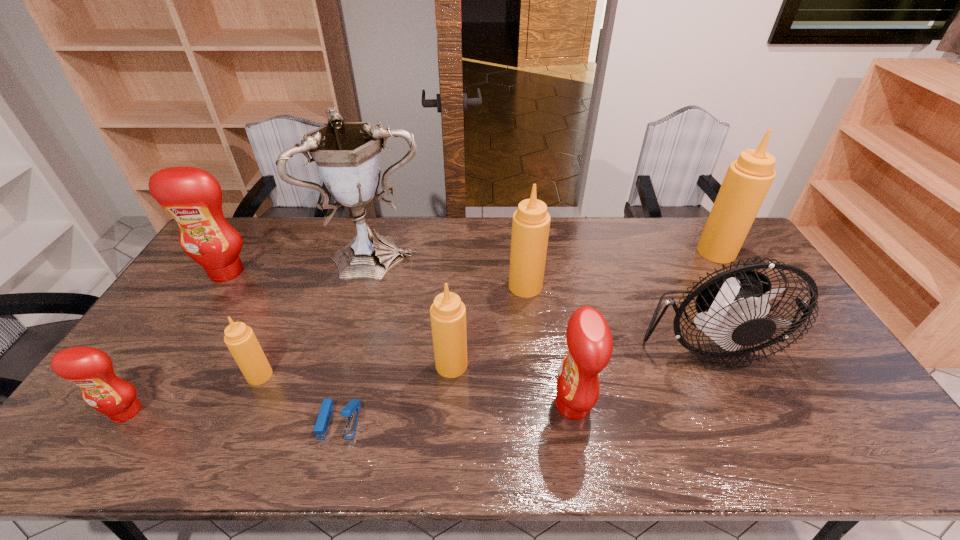
The height and width of the screenshot is (540, 960). In order to click on free space that is in between the second tan condiment from right to left and the biggest tan condiment in this screenshot , I will do `click(621, 269)`.

Where is `vacant space in between the third condiment from left to right and the second smallest tan condiment`? This screenshot has height=540, width=960. vacant space in between the third condiment from left to right and the second smallest tan condiment is located at coordinates (355, 370).

Where is `empty space that is in between the gray trophy cup and the third tan condiment from left to right`? empty space that is in between the gray trophy cup and the third tan condiment from left to right is located at coordinates (452, 270).

Find the location of `unoccupied position between the third nearest tan condiment and the shortest object`. unoccupied position between the third nearest tan condiment and the shortest object is located at coordinates (432, 354).

Find the location of a particular element. empty space between the second tan condiment from right to left and the stapler is located at coordinates (432, 354).

Image resolution: width=960 pixels, height=540 pixels. What are the coordinates of `object that stands as the eighth closest to the tallest condiment` in the screenshot? It's located at (193, 197).

Identify which object is the closest to the rightmost red condiment. Please provide its 2D coordinates. Your answer should be formatted as a tuple, i.e. [(x, y)], where the tuple contains the x and y coordinates of a point satisfying the conditions above.

[(732, 305)]

The width and height of the screenshot is (960, 540). I want to click on condiment object that ranks as the closest to the biggest red condiment, so click(x=240, y=339).

Identify which condiment is located as the third nearest to the third tan condiment from right to left. Please provide its 2D coordinates. Your answer should be formatted as a tuple, i.e. [(x, y)], where the tuple contains the x and y coordinates of a point satisfying the conditions above.

[(240, 339)]

This screenshot has width=960, height=540. In order to click on tan condiment that is the third nearest to the fourth condiment from left to right in this screenshot , I will do `click(747, 181)`.